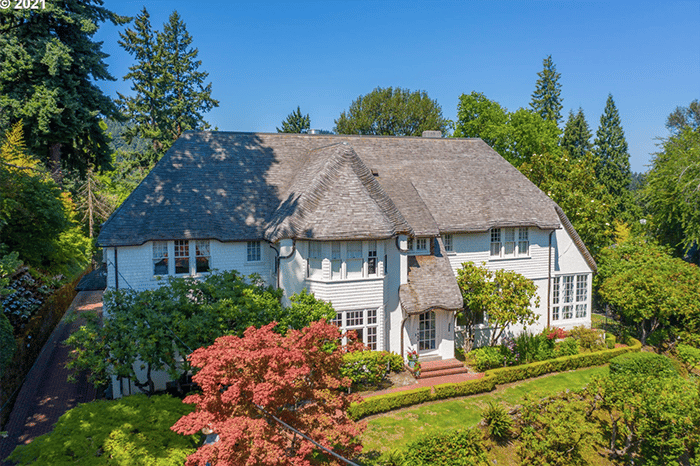
Where is `stairs`? Image resolution: width=700 pixels, height=466 pixels. stairs is located at coordinates pyautogui.click(x=442, y=368).